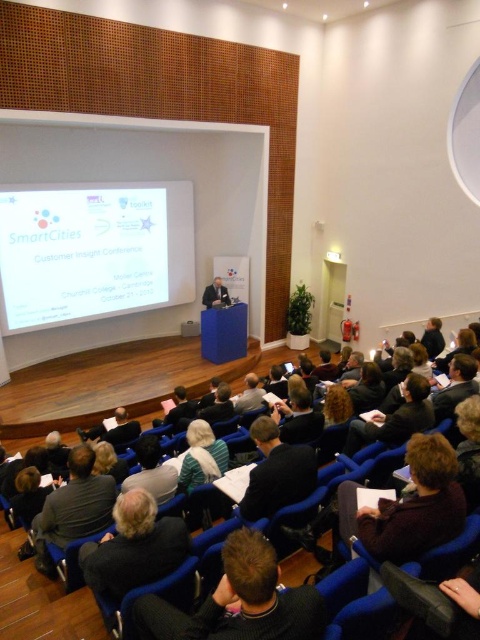
Is dark brown sweater at lower center bigger than dark gray sweater at lower left?

Incorrect, dark brown sweater at lower center is not larger than dark gray sweater at lower left.

Which is below, dark brown sweater at lower center or dark gray sweater at lower left?

dark gray sweater at lower left is below.

Is point (230, 552) positioned after point (72, 484)?

No, (230, 552) is closer to viewer.

The height and width of the screenshot is (640, 480). I want to click on dark brown sweater at lower center, so click(x=240, y=602).

Can you confirm if dark brown hair at lower center is positioned to the right of dark suit at center?

Incorrect, dark brown hair at lower center is not on the right side of dark suit at center.

Measure the distance between dark brown hair at lower center and dark suit at center.

A distance of 19.03 feet exists between dark brown hair at lower center and dark suit at center.

What do you see at coordinates (133, 547) in the screenshot? Image resolution: width=480 pixels, height=640 pixels. I see `dark brown hair at lower center` at bounding box center [133, 547].

This screenshot has height=640, width=480. In order to click on dark brown hair at lower center in this screenshot , I will do `click(133, 547)`.

From the picture: Is dark brown sweater at lower center taller than green striped sweater at center?

Yes.

Measure the distance from dark brown sweater at lower center to green striped sweater at center.

dark brown sweater at lower center is 6.07 feet away from green striped sweater at center.

Identify the location of dark brown sweater at lower center. This screenshot has height=640, width=480. (240, 602).